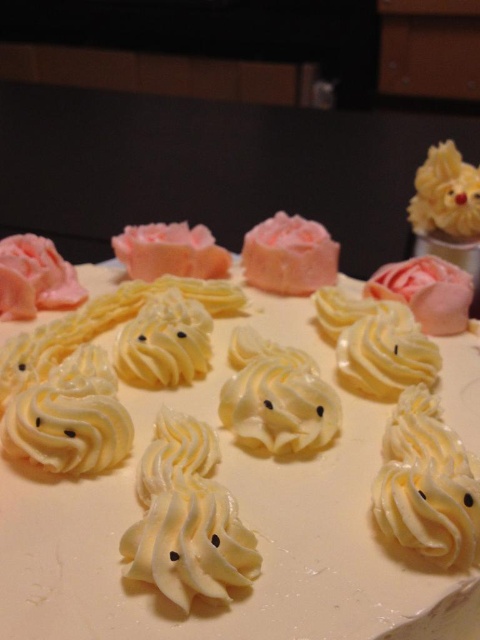
Can you confirm if white cream meringues at center is shorter than pink frosted cake at center?

No.

This screenshot has width=480, height=640. I want to click on white cream meringues at center, so click(x=231, y=465).

At what (x,y) coordinates should I click in order to perform the action: click on white cream meringues at center. Please return your answer as a coordinate pair (x, y). The image size is (480, 640). Looking at the image, I should click on click(231, 465).